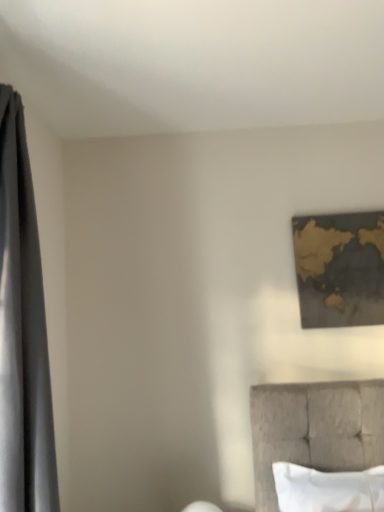
Based on the photo, measure the distance between point [294,505] and camera.

They are 1.93 meters apart.

You are a GUI agent. You are given a task and a screenshot of the screen. Output one action in this format:
    pyautogui.click(x=<x>, y=<y>)
    Task: Click on the gold metallic map at upper right
    The image size is (384, 512).
    Given the screenshot: What is the action you would take?
    [x=340, y=269]

Based on their positions, is white soft pillow at lower right located to the left or right of gold metallic map at upper right?

Clearly, white soft pillow at lower right is on the left of gold metallic map at upper right in the image.

Which of these two, white soft pillow at lower right or gold metallic map at upper right, is thinner?

Thinner between the two is gold metallic map at upper right.

Could you tell me if white soft pillow at lower right is turned towards gold metallic map at upper right?

No.

Does white soft pillow at lower right have a larger size compared to gold metallic map at upper right?

Yes.

From the image's perspective, which is below, silky gray curtain at left or white soft pillow at lower right?

From the image's view, white soft pillow at lower right is below.

Which object is thinner, silky gray curtain at left or white soft pillow at lower right?

white soft pillow at lower right is thinner.

From their relative heights in the image, would you say silky gray curtain at left is taller or shorter than white soft pillow at lower right?

silky gray curtain at left is taller than white soft pillow at lower right.

Is gold metallic map at upper right beside white soft pillow at lower right?

gold metallic map at upper right and white soft pillow at lower right are clearly separated.

Measure the distance between gold metallic map at upper right and white soft pillow at lower right.

They are 89.23 centimeters apart.

Is gold metallic map at upper right wider or thinner than white soft pillow at lower right?

Clearly, gold metallic map at upper right has less width compared to white soft pillow at lower right.

From their relative heights in the image, would you say gold metallic map at upper right is taller or shorter than white soft pillow at lower right?

gold metallic map at upper right is taller than white soft pillow at lower right.

Between silky gray curtain at left and gold metallic map at upper right, which one appears on the right side from the viewer's perspective?

Positioned to the right is gold metallic map at upper right.

In the scene shown: Is silky gray curtain at left spatially inside gold metallic map at upper right, or outside of it?

The correct answer is: outside.

From a real-world perspective, is silky gray curtain at left beneath gold metallic map at upper right?

Yes, from a real-world perspective, silky gray curtain at left is beneath gold metallic map at upper right.

Is silky gray curtain at left touching gold metallic map at upper right?

There is a gap between silky gray curtain at left and gold metallic map at upper right.

Is white soft pillow at lower right shorter than silky gray curtain at left?

Yes.

Relative to silky gray curtain at left, is white soft pillow at lower right in front or behind?

Clearly, white soft pillow at lower right is behind silky gray curtain at left.

Considering the relative positions of white soft pillow at lower right and silky gray curtain at left in the image provided, is white soft pillow at lower right to the right of silky gray curtain at left from the viewer's perspective?

Indeed, white soft pillow at lower right is positioned on the right side of silky gray curtain at left.

Looking at this image, measure the distance between white soft pillow at lower right and silky gray curtain at left.

white soft pillow at lower right and silky gray curtain at left are 1.27 meters apart from each other.

From a real-world perspective, is gold metallic map at upper right physically located above or below silky gray curtain at left?

gold metallic map at upper right is situated higher than silky gray curtain at left in the real world.

Can you confirm if gold metallic map at upper right is bigger than silky gray curtain at left?

Incorrect, gold metallic map at upper right is not larger than silky gray curtain at left.

Is gold metallic map at upper right looking in the opposite direction of silky gray curtain at left?

No, gold metallic map at upper right's orientation is not away from silky gray curtain at left.

Between gold metallic map at upper right and silky gray curtain at left, which one has less height?

Standing shorter between the two is gold metallic map at upper right.

Find the location of a particular element. The height and width of the screenshot is (512, 384). pillow below the gold metallic map at upper right (from a real-world perspective) is located at coordinates (328, 489).

Find the location of `pillow on the right of silky gray curtain at left`. pillow on the right of silky gray curtain at left is located at coordinates (328, 489).

Looking at the image, which one is located closer to gold metallic map at upper right, white soft pillow at lower right or silky gray curtain at left?

Based on the image, white soft pillow at lower right appears to be nearer to gold metallic map at upper right.

From the image, which object appears to be farther from silky gray curtain at left, gold metallic map at upper right or white soft pillow at lower right?

gold metallic map at upper right lies further to silky gray curtain at left than the other object.

From the image, which object appears to be farther from white soft pillow at lower right, gold metallic map at upper right or silky gray curtain at left?

Among the two, silky gray curtain at left is located further to white soft pillow at lower right.

Based on their spatial positions, is white soft pillow at lower right or gold metallic map at upper right closer to silky gray curtain at left?

Among the two, white soft pillow at lower right is located nearer to silky gray curtain at left.

Considering their positions, is silky gray curtain at left positioned closer to gold metallic map at upper right than white soft pillow at lower right?

Based on the image, white soft pillow at lower right appears to be nearer to gold metallic map at upper right.

Considering their positions, is silky gray curtain at left positioned further to white soft pillow at lower right than gold metallic map at upper right?

The object further to white soft pillow at lower right is silky gray curtain at left.

I want to click on pillow between silky gray curtain at left and gold metallic map at upper right in the horizontal direction, so click(x=328, y=489).